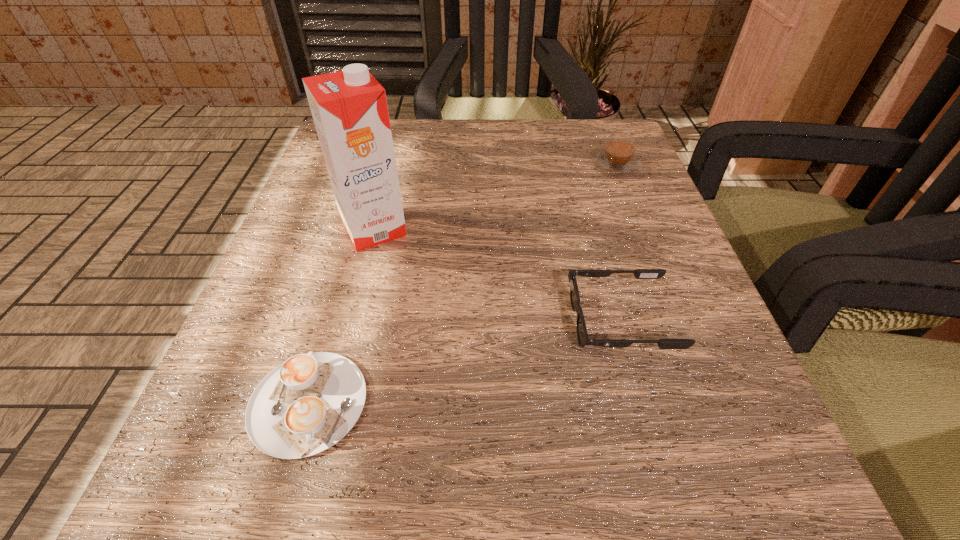
You are a GUI agent. You are given a task and a screenshot of the screen. Output one action in this format:
    pyautogui.click(x=<x>, y=<y>)
    Task: Click on the vacant region located on the temples of the third tallest object
    
    Given the screenshot: What is the action you would take?
    pyautogui.click(x=483, y=321)

Identify the location of free space located on the temples of the third tallest object. (315, 321).

At what (x,y) coordinates should I click in order to perform the action: click on free location located on the back of the nearer cappuccino. Please return your answer as a coordinate pair (x, y). Looking at the image, I should click on (344, 281).

Where is `object positioned at the far edge`? object positioned at the far edge is located at coordinates click(618, 159).

Find the location of a particular element. The image size is (960, 540). object situated at the near edge is located at coordinates (307, 404).

Locate an element on the screen. The height and width of the screenshot is (540, 960). carton positioned at the left edge is located at coordinates (349, 108).

Locate an element on the screen. cappuccino positioned at the left edge is located at coordinates (307, 404).

I want to click on cappuccino positioned at the right edge, so click(x=618, y=159).

At what (x,y) coordinates should I click in order to perform the action: click on sunglasses at the right edge. Please return your answer as a coordinate pair (x, y). The image size is (960, 540). Looking at the image, I should click on (582, 335).

Identify the location of object present at the near left corner. This screenshot has width=960, height=540. (307, 404).